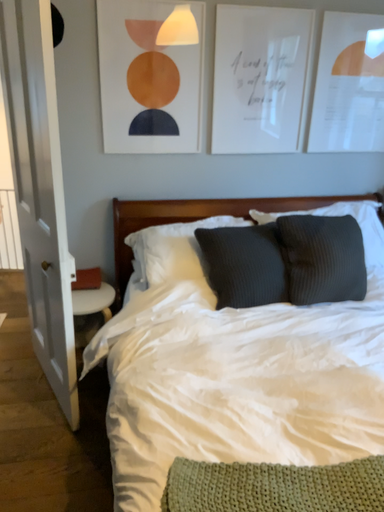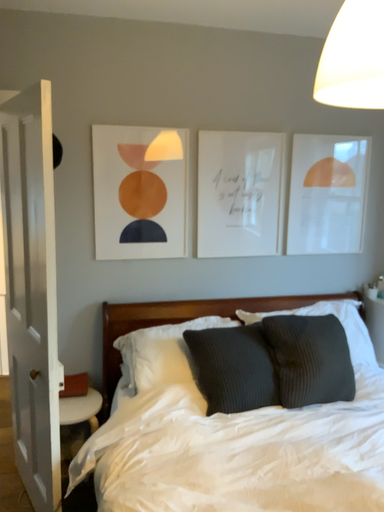
Question: How did the camera likely rotate when shooting the video?

Choices:
 (A) rotated downward
 (B) rotated upward

Answer: (B)